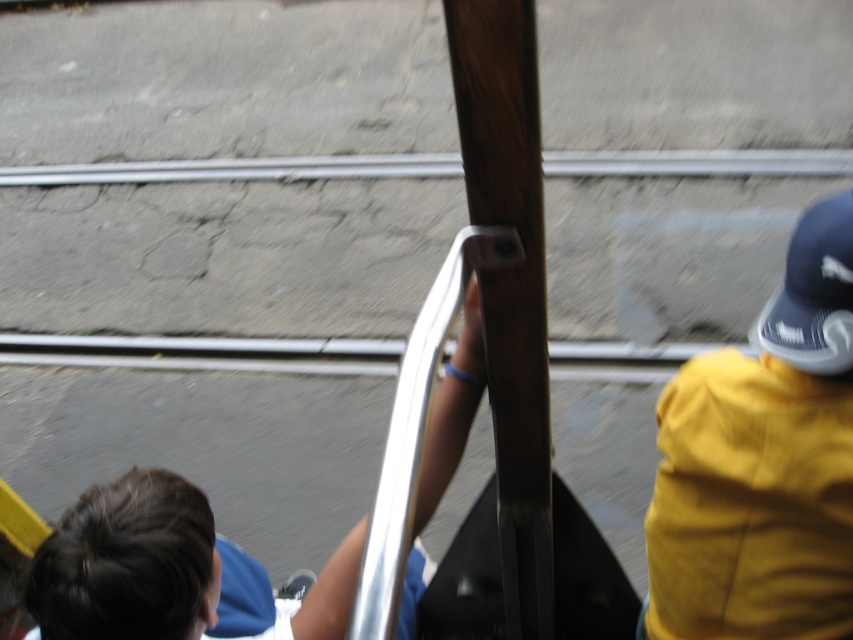
Is point (834, 176) more distant than point (840, 209)?

That is True.

Can you confirm if silver metallic rail at upper center is shorter than blue fabric baseball cap at upper right?

In fact, silver metallic rail at upper center may be taller than blue fabric baseball cap at upper right.

You are a GUI agent. You are given a task and a screenshot of the screen. Output one action in this format:
    pyautogui.click(x=<x>, y=<y>)
    Task: Click on the silver metallic rail at upper center
    
    Given the screenshot: What is the action you would take?
    pyautogui.click(x=239, y=170)

Locate an element on the screen. silver metallic rail at upper center is located at coordinates (239, 170).

Can you confirm if blue fabric shirt at center is wider than silver metallic rail at upper center?

No, blue fabric shirt at center is not wider than silver metallic rail at upper center.

Measure the distance between blue fabric shirt at center and camera.

The distance of blue fabric shirt at center from camera is 31.46 inches.

Locate an element on the screen. This screenshot has width=853, height=640. blue fabric shirt at center is located at coordinates (173, 572).

Is yellow fabric cap at right thinner than blue fabric shirt at center?

Yes.

Between point (718, 593) and point (90, 545), which one is positioned behind?

Point (718, 593)

Between point (751, 435) and point (115, 534), which one is positioned in front?

Point (115, 534)

Where is `yellow fabric cap at right`? yellow fabric cap at right is located at coordinates (762, 464).